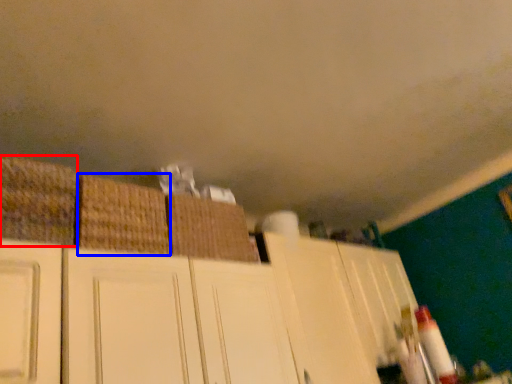
Question: Which of the following is the farthest to the observer, basket (highlighted by a red box) or basket (highlighted by a blue box)?

Choices:
 (A) basket
 (B) basket

Answer: (B)